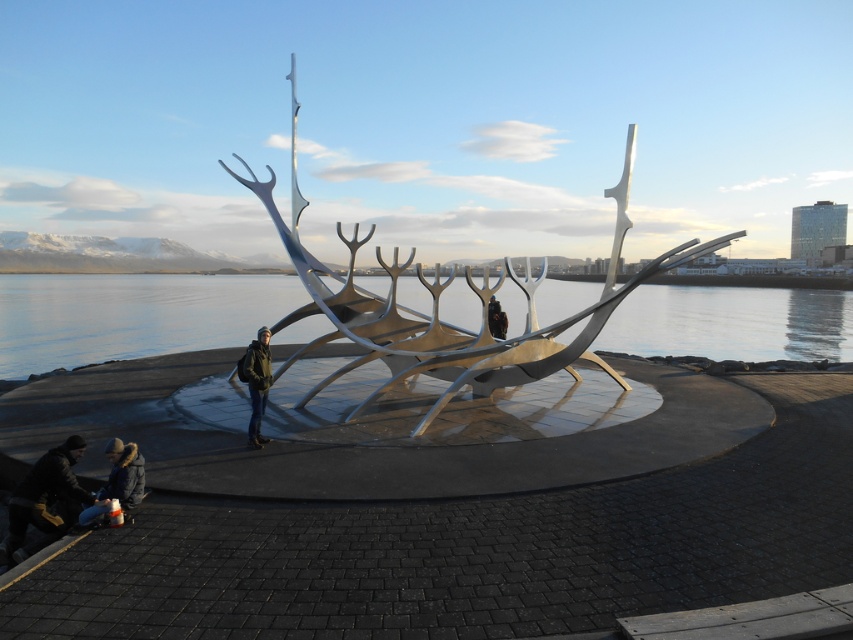
Question: Which of the following is the closest to the observer?

Choices:
 (A) (241, 364)
 (B) (807, 340)

Answer: (A)

Question: Is dark blue jacket at lower left in front of black matte person at center?

Choices:
 (A) no
 (B) yes

Answer: (B)

Question: Estimate the real-world distances between objects in this image. Which object is farther from the black matte person at center?

Choices:
 (A) dark brown leather jacket at lower left
 (B) dark green jacket at center
 (C) silver metallic boat at center

Answer: (A)

Question: Is transparent glass water at center to the left of dark brown leather jacket at lower left from the viewer's perspective?

Choices:
 (A) no
 (B) yes

Answer: (A)

Question: Which object is positioned closest to the dark blue jacket at lower left?

Choices:
 (A) silver metallic boat at center
 (B) black matte person at center
 (C) dark green jacket at center

Answer: (C)

Question: From the image, what is the correct spatial relationship of silver metallic boat at center in relation to dark green jacket at center?

Choices:
 (A) above
 (B) below

Answer: (A)